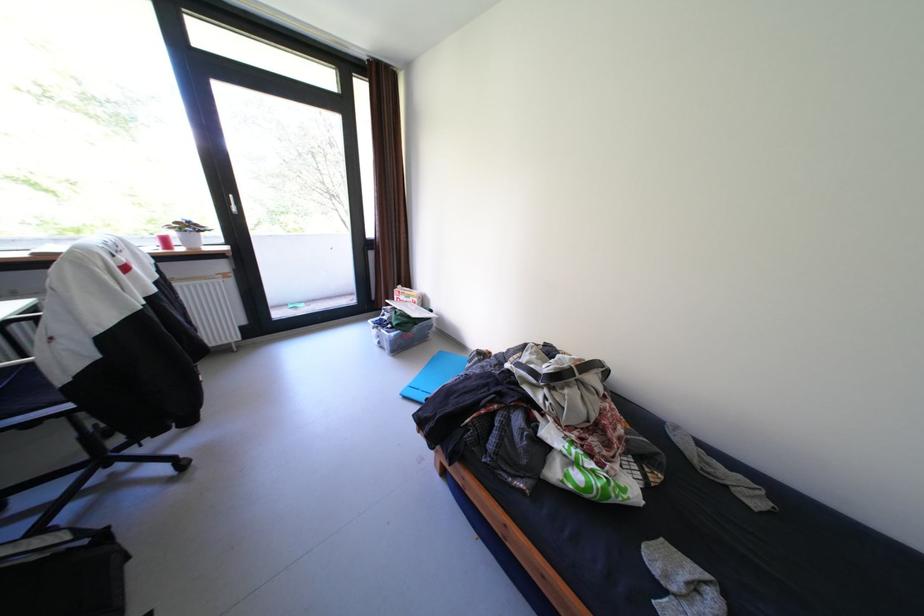
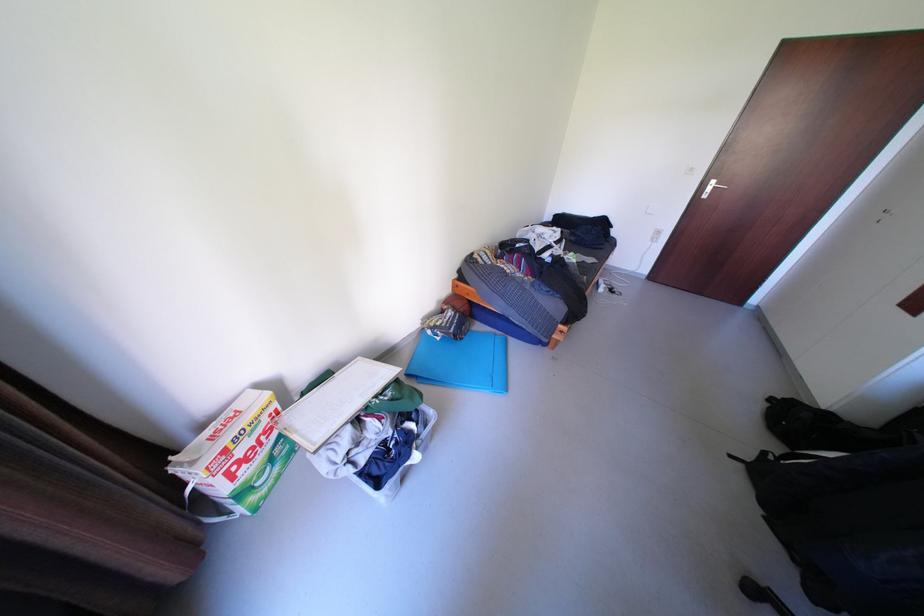
Find the pixel in the second image that matches (395,318) in the first image.

(372, 459)